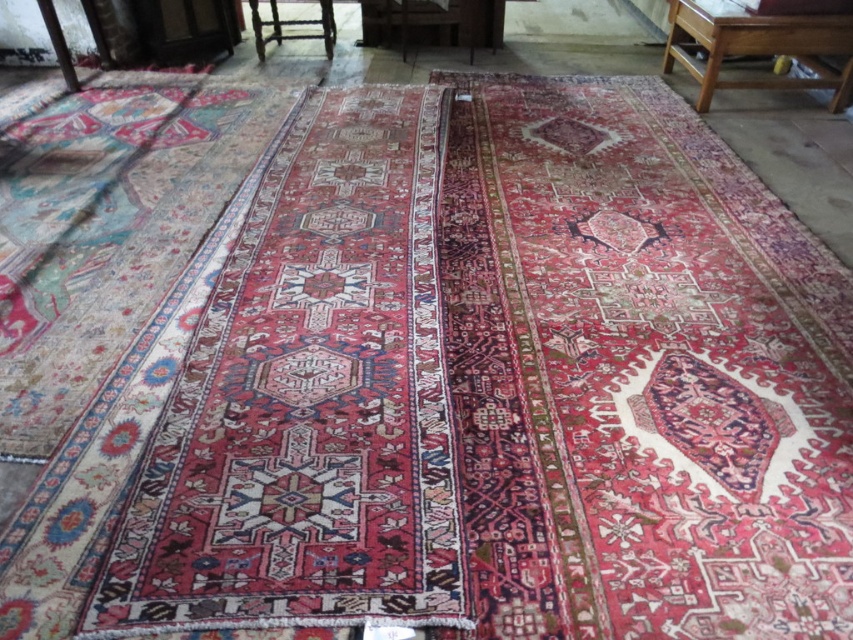
Question: Does wooden table at upper right appear over wooden chair at upper center?

Choices:
 (A) yes
 (B) no

Answer: (B)

Question: Which of the following is the farthest from the observer?

Choices:
 (A) wooden table at upper right
 (B) wooden chair at center
 (C) wooden chair at upper center

Answer: (B)

Question: Which object is the farthest from the wooden chair at center?

Choices:
 (A) wooden table at upper right
 (B) wooden chair at upper center

Answer: (A)

Question: Among these objects, which one is nearest to the camera?

Choices:
 (A) wooden table at upper right
 (B) wooden chair at center

Answer: (A)

Question: Is wooden table at upper right to the left of wooden chair at center from the viewer's perspective?

Choices:
 (A) no
 (B) yes

Answer: (A)

Question: Can you confirm if wooden chair at upper center is positioned to the right of wooden chair at center?

Choices:
 (A) no
 (B) yes

Answer: (A)